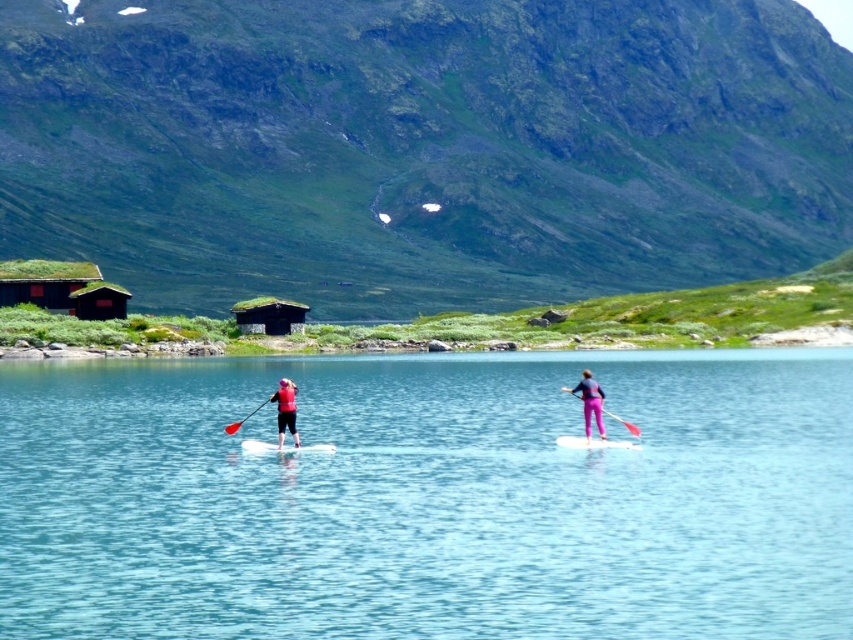
You are planning to build a small boat dock near the clear blue water at center and the green mossy roof hut at center. Which object should the dock be closer to if you want it to be near the wider area?

The dock should be closer to the clear blue water at center because it might be wider than the green mossy roof hut at center.

You are standing at point (282, 403) and want to reach the cabins in the background. The distance between you and the cabins is 182.23 feet. Can you estimate if you can walk to the cabins within 10 minutes if your walking speed is 3 feet per second?

The distance between you and the cabins is 182.23 feet. At a walking speed of 3 feet per second, it would take approximately 60.7 seconds, which is about 1 minute. Therefore, you can reach the cabins within 10 minutes.

Looking at this image, you are standing at the edge of the water in the serene outdoor scene. You see two points marked in the image. Which point is closer to you, point (500, 602) or point (251, 444)?

Point (500, 602) is closer to the viewer than point (251, 444).